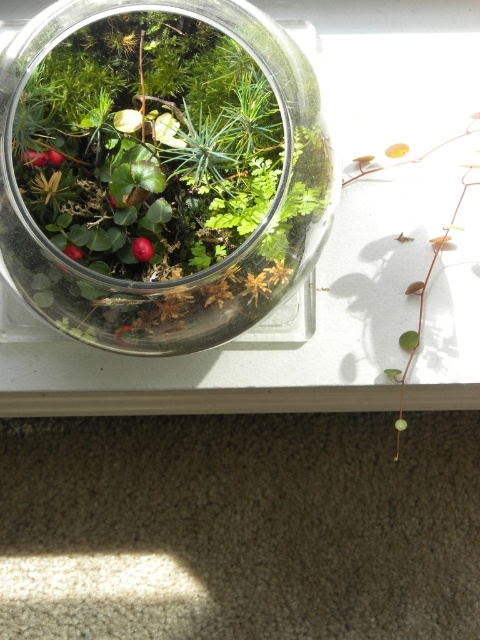
Question: Considering the relative positions of transparent glass terrarium at center and green glossy leaf at center in the image provided, where is transparent glass terrarium at center located with respect to green glossy leaf at center?

Choices:
 (A) right
 (B) left

Answer: (B)

Question: Is transparent glass terrarium at center above green glossy leaf at center?

Choices:
 (A) yes
 (B) no

Answer: (A)

Question: Among these objects, which one is nearest to the camera?

Choices:
 (A) green glossy leaf at center
 (B) transparent glass terrarium at center

Answer: (B)

Question: Does transparent glass terrarium at center have a smaller size compared to green glossy leaf at center?

Choices:
 (A) no
 (B) yes

Answer: (A)